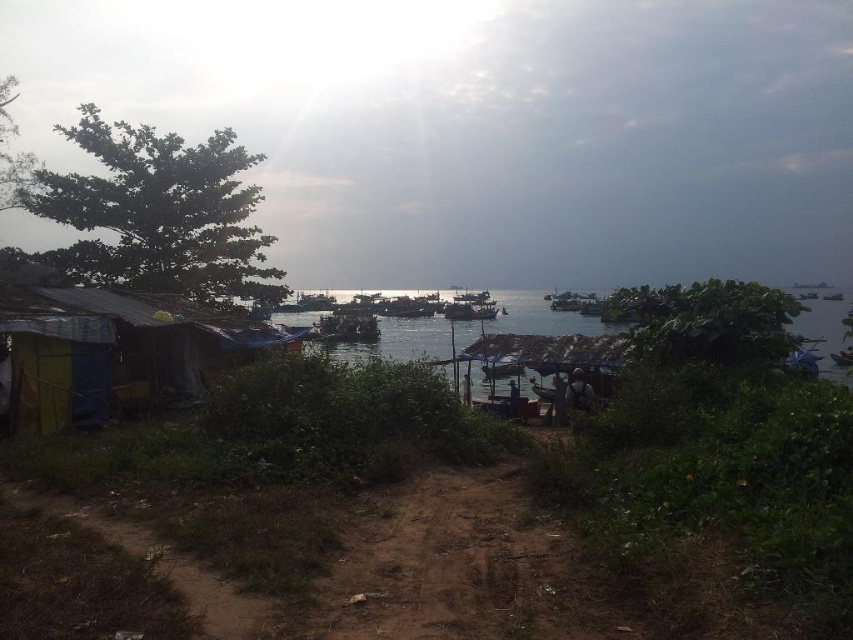
Consider the image. Is multicolored tarpaulin hut at lower left to the left of clear water at center from the viewer's perspective?

Yes, multicolored tarpaulin hut at lower left is to the left of clear water at center.

Does multicolored tarpaulin hut at lower left have a smaller size compared to clear water at center?

Indeed, multicolored tarpaulin hut at lower left has a smaller size compared to clear water at center.

Where is `multicolored tarpaulin hut at lower left`? multicolored tarpaulin hut at lower left is located at coordinates (114, 355).

Image resolution: width=853 pixels, height=640 pixels. I want to click on multicolored tarpaulin hut at lower left, so click(x=114, y=355).